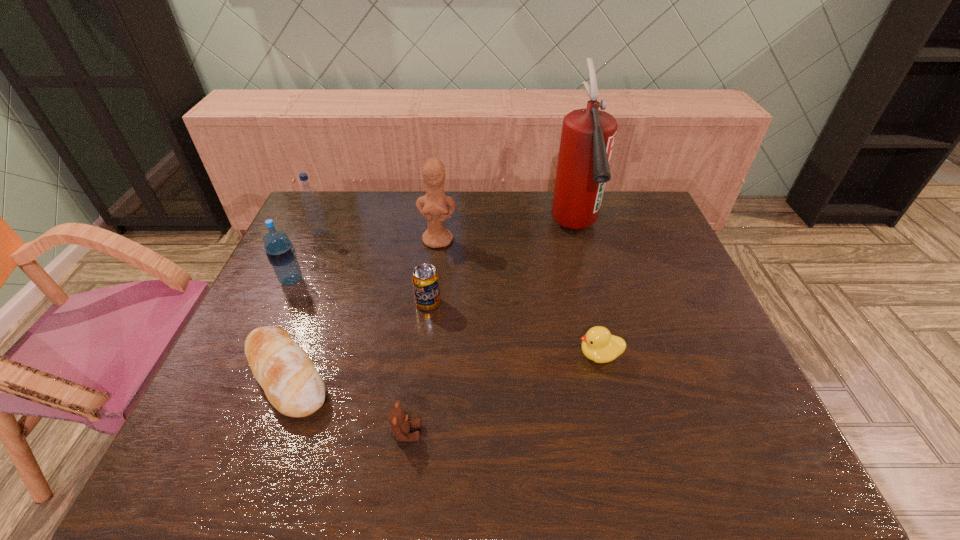
The height and width of the screenshot is (540, 960). I want to click on figurine positioned at the far edge, so click(x=433, y=206).

The height and width of the screenshot is (540, 960). In order to click on water bottle at the far edge in this screenshot , I will do `click(310, 199)`.

Where is `object present at the near edge`? This screenshot has width=960, height=540. object present at the near edge is located at coordinates (400, 423).

At what (x,y) coordinates should I click in order to perform the action: click on bread positioned at the left edge. Please return your answer as a coordinate pair (x, y). Looking at the image, I should click on (292, 384).

Find the location of `object that is at the far left corner`. object that is at the far left corner is located at coordinates (310, 199).

This screenshot has width=960, height=540. I want to click on vacant space at the far edge of the desktop, so click(348, 226).

The height and width of the screenshot is (540, 960). In order to click on free space at the near edge of the desktop in this screenshot , I will do `click(528, 435)`.

The image size is (960, 540). What are the coordinates of `free location at the left edge of the desktop` in the screenshot? It's located at (309, 239).

Find the location of a particular element. The image size is (960, 540). vacant region at the right edge is located at coordinates (662, 281).

The width and height of the screenshot is (960, 540). In order to click on vacant space at the far left corner of the desktop in this screenshot , I will do point(337,230).